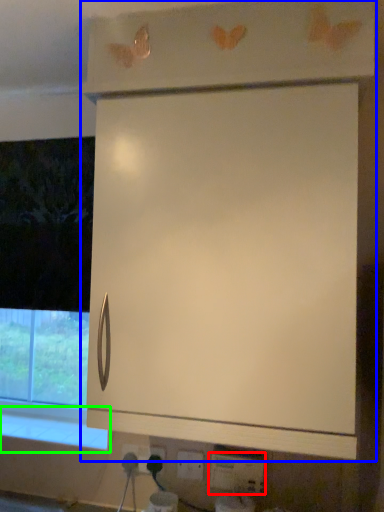
Question: Based on their relative distances, which object is farther from electric outlet (highlighted by a red box)? Choose from cabinetry (highlighted by a blue box) and window sill (highlighted by a green box).

Choices:
 (A) cabinetry
 (B) window sill

Answer: (A)